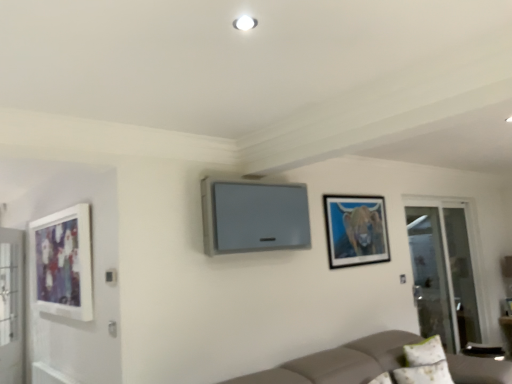
Question: Is matte white picture frame at left, the 2th picture frame when ordered from right to left, to the right of white fabric pillow at lower right from the viewer's perspective?

Choices:
 (A) yes
 (B) no

Answer: (B)

Question: From a real-world perspective, is matte white picture frame at left, the 2th picture frame when ordered from right to left, below white fabric pillow at lower right?

Choices:
 (A) yes
 (B) no

Answer: (B)

Question: Can you confirm if matte white picture frame at left, the 2th picture frame when ordered from right to left, is shorter than white fabric pillow at lower right?

Choices:
 (A) no
 (B) yes

Answer: (A)

Question: From a real-world perspective, is matte white picture frame at left, the 2th picture frame when ordered from right to left, on white fabric pillow at lower right?

Choices:
 (A) no
 (B) yes

Answer: (B)

Question: From the image's perspective, would you say matte white picture frame at left, which is the 1th picture frame in left-to-right order, is shown under white fabric pillow at lower right?

Choices:
 (A) no
 (B) yes

Answer: (A)

Question: From the image's perspective, is transparent glass screen door at right, which ranks as the 1th screen door in back-to-front order, located above or below white fabric pillow at lower right?

Choices:
 (A) below
 (B) above

Answer: (B)

Question: Relative to white fabric pillow at lower right, is transparent glass screen door at right, which ranks as the 1th screen door in back-to-front order, in front or behind?

Choices:
 (A) front
 (B) behind

Answer: (B)

Question: From a real-world perspective, is transparent glass screen door at right, which is the second screen door from left to right, physically located above or below white fabric pillow at lower right?

Choices:
 (A) below
 (B) above

Answer: (B)

Question: Is transparent glass screen door at right, which is the second screen door from left to right, bigger or smaller than white fabric pillow at lower right?

Choices:
 (A) small
 (B) big

Answer: (B)

Question: Would you say matte white picture frame at left, which is the 1th picture frame in left-to-right order, is inside or outside matte black picture frame at upper right, marked as the first picture frame in a right-to-left arrangement?

Choices:
 (A) inside
 (B) outside

Answer: (B)

Question: Does point (53, 218) appear closer or farther from the camera than point (369, 198)?

Choices:
 (A) farther
 (B) closer

Answer: (B)

Question: From a real-world perspective, is matte white picture frame at left, the 2th picture frame when ordered from right to left, above or below matte black picture frame at upper right, marked as the first picture frame in a right-to-left arrangement?

Choices:
 (A) above
 (B) below

Answer: (B)

Question: Would you say matte white picture frame at left, the 2th picture frame when ordered from right to left, is to the left or to the right of matte black picture frame at upper right, which is the second picture frame in left-to-right order, in the picture?

Choices:
 (A) right
 (B) left

Answer: (B)

Question: Would you say transparent glass screen door at right, the 1th screen door in the right-to-left sequence, is inside or outside matte black picture frame at upper right, which is the second picture frame in left-to-right order?

Choices:
 (A) inside
 (B) outside

Answer: (B)

Question: In terms of size, does transparent glass screen door at right, which ranks as the 1th screen door in back-to-front order, appear bigger or smaller than matte black picture frame at upper right, which is the second picture frame in left-to-right order?

Choices:
 (A) small
 (B) big

Answer: (B)